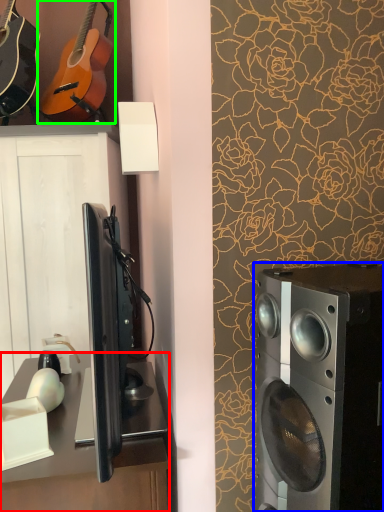
Question: Considering the real-world distances, which object is farthest from desk (highlighted by a red box)? home appliance (highlighted by a blue box) or guitar (highlighted by a green box)?

Choices:
 (A) home appliance
 (B) guitar

Answer: (B)